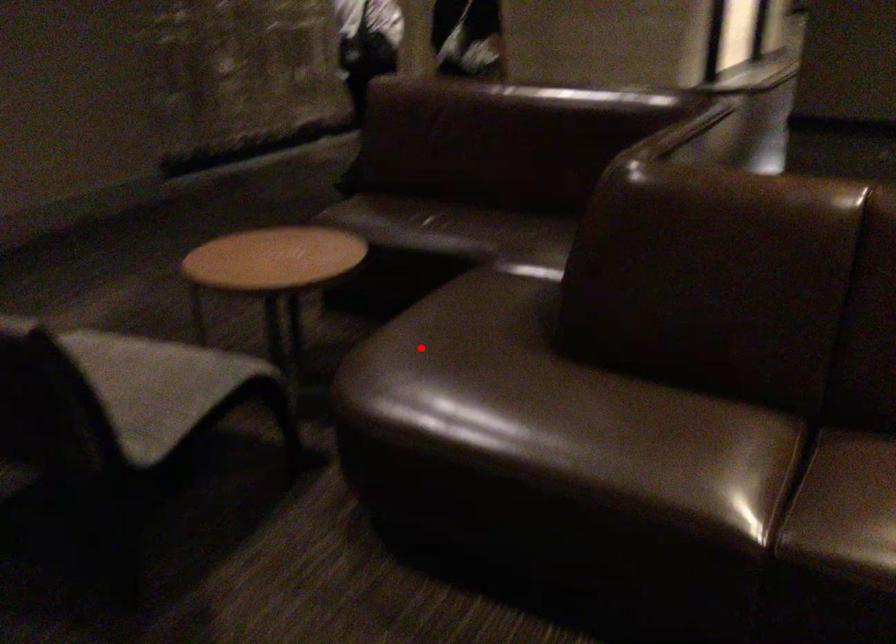
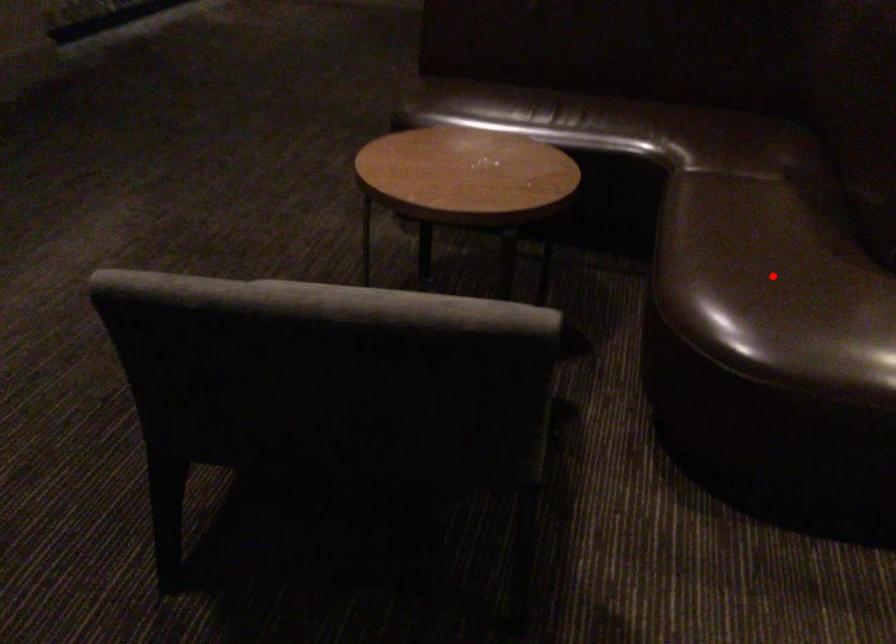
I am providing you with two images of the same scene from different viewpoints. A red point is marked on the first image and another point is marked on the second image. Do the highlighted points in image1 and image2 indicate the same real-world spot?

Yes